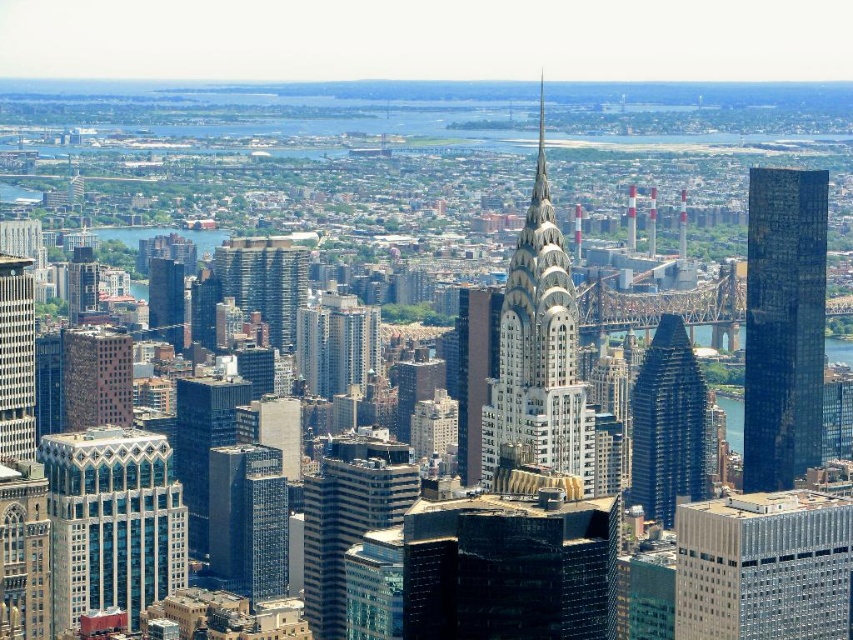
Can you confirm if metallic glass skyscraper at center-left is bigger than matte glass building at lower left?

Correct, metallic glass skyscraper at center-left is larger in size than matte glass building at lower left.

Between point (109, 433) and point (109, 420), which one is positioned behind?

The point (109, 433) is behind.

The height and width of the screenshot is (640, 853). Describe the element at coordinates (112, 522) in the screenshot. I see `metallic glass skyscraper at center-left` at that location.

Where is `metallic glass skyscraper at center-left`? Image resolution: width=853 pixels, height=640 pixels. metallic glass skyscraper at center-left is located at coordinates (112, 522).

Is matte glass skyscraper at left below shiny glass skyscraper at center?

No, matte glass skyscraper at left is not below shiny glass skyscraper at center.

Between matte glass skyscraper at left and shiny glass skyscraper at center, which one appears on the right side from the viewer's perspective?

From the viewer's perspective, shiny glass skyscraper at center appears more on the right side.

Describe the element at coordinates (16, 358) in the screenshot. I see `matte glass skyscraper at left` at that location.

This screenshot has width=853, height=640. In order to click on matte glass skyscraper at left in this screenshot , I will do `click(16, 358)`.

Does glossy glass skyscraper at center-right appear on the left side of matte glass skyscraper at left?

Incorrect, glossy glass skyscraper at center-right is not on the left side of matte glass skyscraper at left.

Is glossy glass skyscraper at center-right shorter than matte glass skyscraper at left?

No.

Measure the distance between glossy glass skyscraper at center-right and camera.

2133.98 feet

Where is `glossy glass skyscraper at center-right`? The image size is (853, 640). glossy glass skyscraper at center-right is located at coordinates (668, 424).